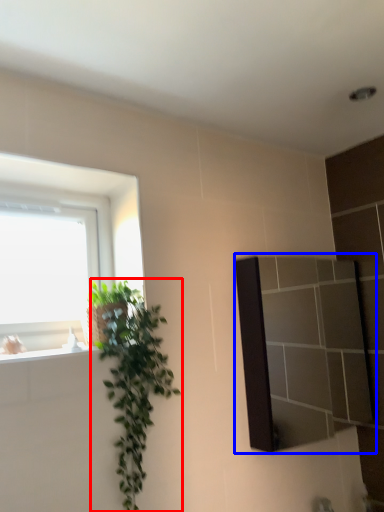
Question: Which of the following is the closest to the observer, houseplant (highlighted by a red box) or mirror (highlighted by a blue box)?

Choices:
 (A) houseplant
 (B) mirror

Answer: (A)